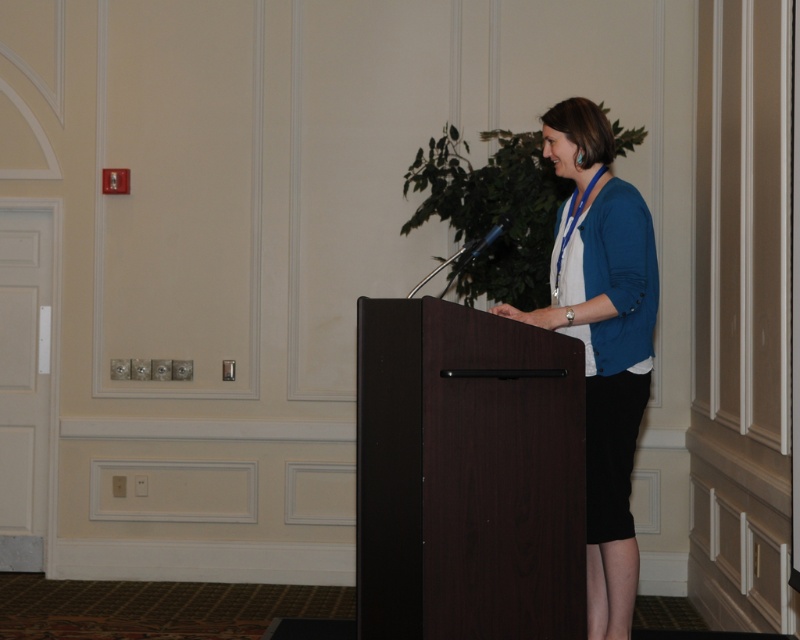
Question: Can you confirm if dark wood podium at center is smaller than blue fabric at center?

Choices:
 (A) yes
 (B) no

Answer: (A)

Question: Among these objects, which one is nearest to the camera?

Choices:
 (A) blue fabric at center
 (B) dark wood podium at center

Answer: (B)

Question: Is dark wood podium at center in front of blue fabric at center?

Choices:
 (A) yes
 (B) no

Answer: (A)

Question: Is dark wood podium at center below blue fabric at center?

Choices:
 (A) no
 (B) yes

Answer: (B)